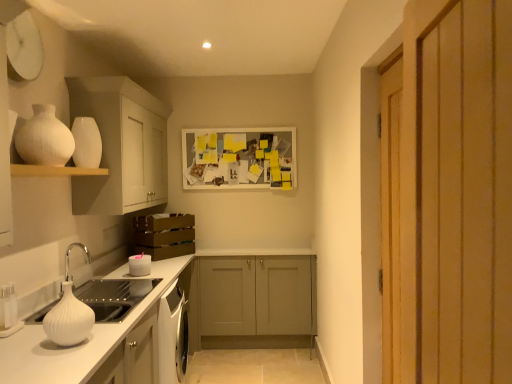
Question: Is matte gray cabinet at center, placed as the second cabinetry when sorted from front to back, at the right side of white matte candle at lower left?

Choices:
 (A) yes
 (B) no

Answer: (A)

Question: Is white matte candle at lower left located within matte gray cabinet at center, the second cabinetry positioned from the top?

Choices:
 (A) no
 (B) yes

Answer: (A)

Question: Are matte gray cabinet at center, which is the 2th cabinetry in left-to-right order, and white matte candle at lower left beside each other?

Choices:
 (A) no
 (B) yes

Answer: (A)

Question: Is matte gray cabinet at center, which is the 1th cabinetry in back-to-front order, facing towards white matte candle at lower left?

Choices:
 (A) yes
 (B) no

Answer: (A)

Question: Is matte gray cabinet at center, the first cabinetry in the right-to-left sequence, further to camera compared to white matte candle at lower left?

Choices:
 (A) yes
 (B) no

Answer: (A)

Question: In the image, is white matte sink at lower left positioned in front of or behind matte gray cabinet at center, which is the 1th cabinetry in back-to-front order?

Choices:
 (A) behind
 (B) front

Answer: (B)

Question: From a real-world perspective, is white matte sink at lower left positioned above or below matte gray cabinet at center, which is the 1th cabinetry in back-to-front order?

Choices:
 (A) above
 (B) below

Answer: (A)

Question: Is white matte sink at lower left bigger or smaller than matte gray cabinet at center, the first cabinetry in the right-to-left sequence?

Choices:
 (A) big
 (B) small

Answer: (B)

Question: Looking at their shapes, would you say white matte sink at lower left is wider or thinner than matte gray cabinet at center, placed as the second cabinetry when sorted from front to back?

Choices:
 (A) thin
 (B) wide

Answer: (A)

Question: Is white matte shelf at upper left spatially inside matte gray cabinet at center, which is the 2th cabinetry in left-to-right order, or outside of it?

Choices:
 (A) outside
 (B) inside

Answer: (A)

Question: Is white matte shelf at upper left taller or shorter than matte gray cabinet at center, which ranks as the first cabinetry in bottom-to-top order?

Choices:
 (A) short
 (B) tall

Answer: (A)

Question: From the image's perspective, is white matte shelf at upper left located above or below matte gray cabinet at center, which is the 1th cabinetry in back-to-front order?

Choices:
 (A) above
 (B) below

Answer: (A)

Question: Is point (83, 173) closer or farther from the camera than point (230, 306)?

Choices:
 (A) farther
 (B) closer

Answer: (B)

Question: Is white matte shelf at upper left wider or thinner than white matte cabinet at upper left, marked as the first cabinetry in a front-to-back arrangement?

Choices:
 (A) thin
 (B) wide

Answer: (A)

Question: Considering the positions of white matte shelf at upper left and white matte cabinet at upper left, the first cabinetry in the top-to-bottom sequence, in the image, is white matte shelf at upper left bigger or smaller than white matte cabinet at upper left, the first cabinetry in the top-to-bottom sequence,?

Choices:
 (A) big
 (B) small

Answer: (B)